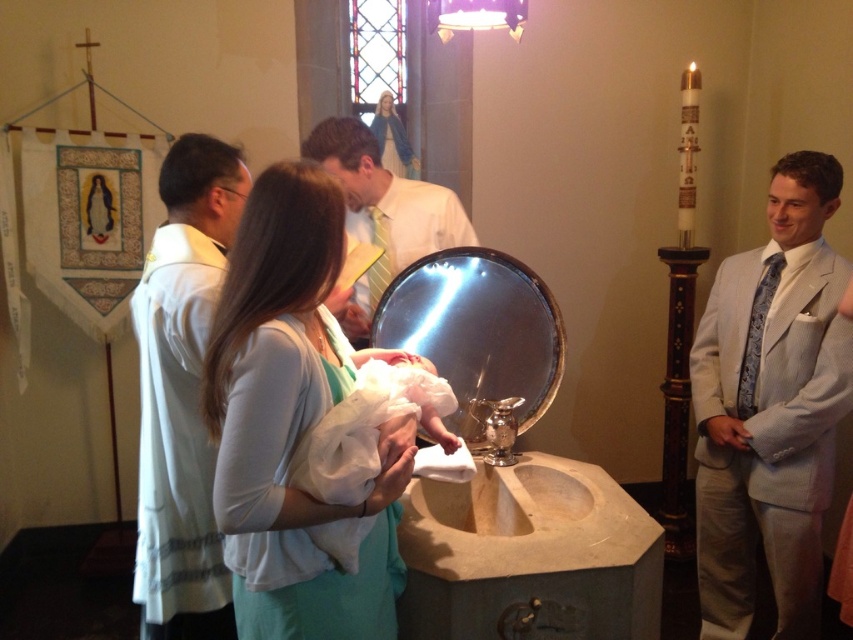
Question: Which of the following is the closest to the observer?

Choices:
 (A) white fabric baby at center
 (B) light gray suit at right

Answer: (A)

Question: Which of the following is the farthest from the observer?

Choices:
 (A) light gray suit at right
 (B) white fabric baby at center

Answer: (A)

Question: Which of the following is the closest to the observer?

Choices:
 (A) (465, 228)
 (B) (231, 624)
 (C) (335, 486)
 (D) (277, 502)

Answer: (D)

Question: Can you confirm if white fabric baby at center is wider than light gray suit at right?

Choices:
 (A) yes
 (B) no

Answer: (A)

Question: Can you confirm if light gray suit at right is positioned below white silk shirt at center?

Choices:
 (A) no
 (B) yes

Answer: (B)

Question: Can you confirm if white silk shirt at center is thinner than white clothed baby at center?

Choices:
 (A) yes
 (B) no

Answer: (B)